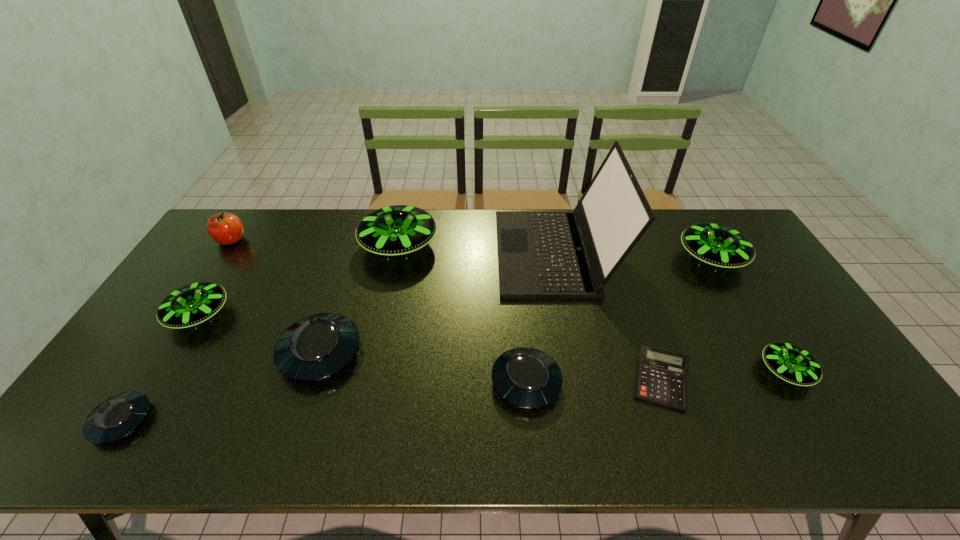
Find the location of a particular element. This screenshot has height=540, width=960. vacant space at the far right corner of the desktop is located at coordinates (717, 222).

Find the location of a particular element. The width and height of the screenshot is (960, 540). free spot between the second biggest green saucer and the second biggest gray saucer is located at coordinates (619, 320).

This screenshot has height=540, width=960. Find the location of `vacant area that lies between the second green saucer from left to right and the shortest object`. vacant area that lies between the second green saucer from left to right and the shortest object is located at coordinates (530, 313).

Where is `free space between the second gray saucer from right to left and the laptop`? free space between the second gray saucer from right to left and the laptop is located at coordinates (438, 302).

This screenshot has height=540, width=960. Find the location of `free space between the nearest green saucer and the biggest green saucer`. free space between the nearest green saucer and the biggest green saucer is located at coordinates (592, 308).

This screenshot has height=540, width=960. Identify the location of vacant region between the tallest saucer and the second biggest gray saucer. (463, 314).

Identify the location of unoccupied position between the biggest gray saucer and the third saucer from right to left. (423, 367).

At what (x,y) coordinates should I click in order to perform the action: click on vacant region between the second shortest object and the apple. Please return your answer as a coordinate pair (x, y). Image resolution: width=960 pixels, height=540 pixels. Looking at the image, I should click on (177, 330).

Identify the location of vacant region between the leftmost green saucer and the nearest green saucer. (492, 343).

Where is `free spot between the rightmost gray saucer and the apple`? free spot between the rightmost gray saucer and the apple is located at coordinates (378, 311).